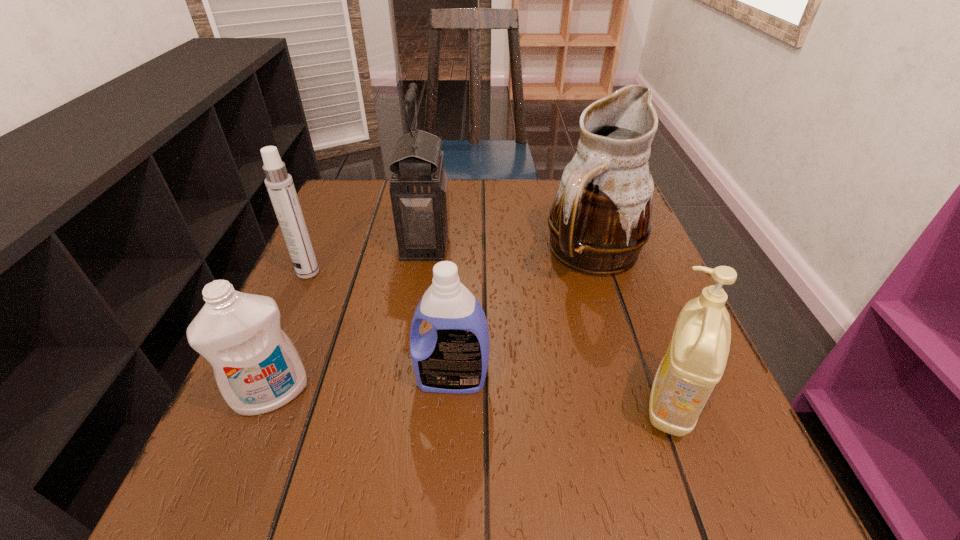
Find the location of a particular element. lantern is located at coordinates (419, 192).

At what (x,y) coordinates should I click in order to perform the action: click on pitcher. Please return your answer as a coordinate pair (x, y). Image resolution: width=960 pixels, height=540 pixels. Looking at the image, I should click on (600, 219).

Where is `aerosol can`? This screenshot has width=960, height=540. aerosol can is located at coordinates (279, 184).

Locate an element on the screen. the second detergent from left to right is located at coordinates (452, 357).

Where is `the leftmost detergent`? The height and width of the screenshot is (540, 960). the leftmost detergent is located at coordinates (257, 368).

The width and height of the screenshot is (960, 540). I want to click on the rightmost detergent, so click(x=695, y=360).

Identify the location of vacant region located on the front-facing side of the lantern. (543, 243).

Where is `free spot located 0.050m from the spout of the pitcher`? This screenshot has height=540, width=960. free spot located 0.050m from the spout of the pitcher is located at coordinates (612, 309).

Find the location of a particular element. The width and height of the screenshot is (960, 540). vacant region located 0.330m on the right of the aerosol can is located at coordinates (470, 272).

Find the location of a particular element. Image resolution: width=960 pixels, height=540 pixels. vacant region located 0.150m on the back of the second detergent from right to left is located at coordinates (456, 303).